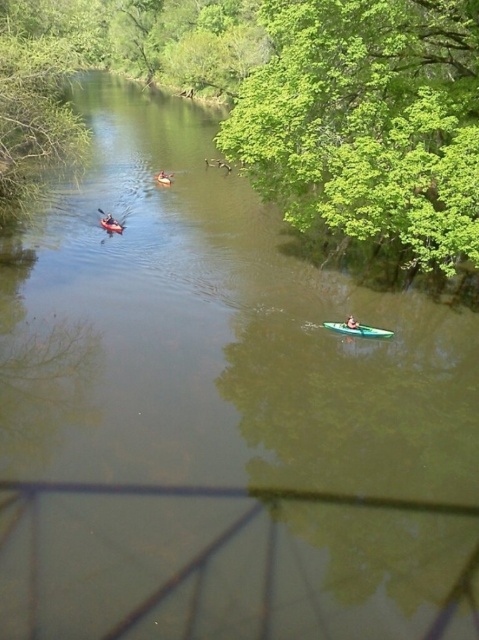
Question: Which point appears closest to the camera in this image?

Choices:
 (A) (112, 220)
 (B) (353, 324)

Answer: (B)

Question: Which object is closer to the camera taking this photo?

Choices:
 (A) orange kayak at center
 (B) orange plastic canoe at center

Answer: (B)

Question: Which of these objects is positioned farthest from the orange kayak at center?

Choices:
 (A) green plastic kayak at lower right
 (B) orange plastic canoe at center
 (C) green leafy tree at upper right

Answer: (A)

Question: Can you confirm if green leafy tree at upper right is bigger than orange kayak at center?

Choices:
 (A) yes
 (B) no

Answer: (A)

Question: Where is orange kayak at center located in relation to green plastic kayak at lower right in the image?

Choices:
 (A) above
 (B) below

Answer: (A)

Question: Does orange kayak at center have a larger size compared to green plastic kayak at lower right?

Choices:
 (A) yes
 (B) no

Answer: (A)